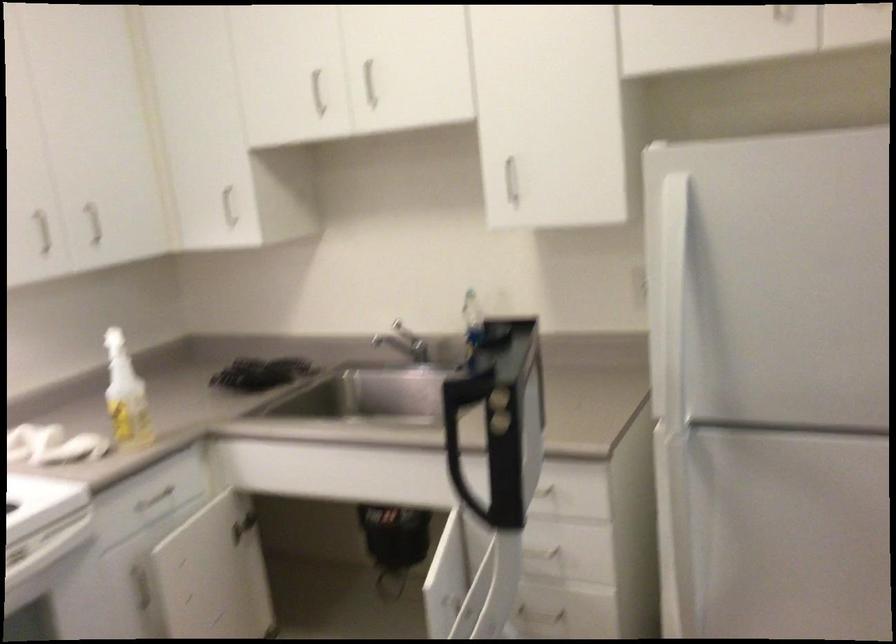
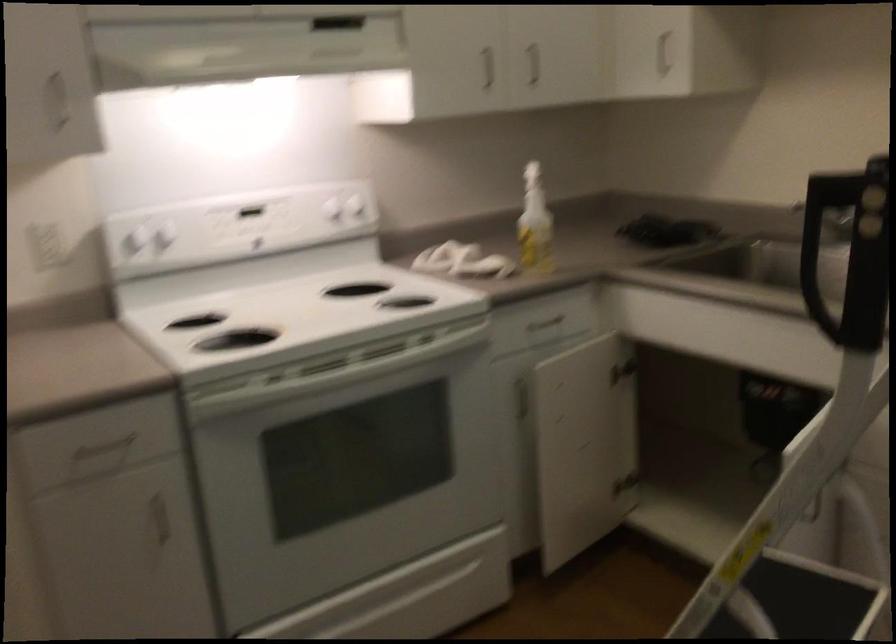
Where in the second image is the point corresponding to point 95,229 from the first image?

(531, 64)